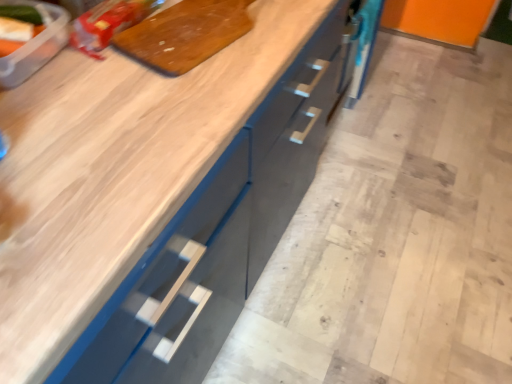
Question: From the image's perspective, is translucent plastic container at upper left, placed as the second food when sorted from right to left, on matte plastic bag at upper left, the second food from the left?

Choices:
 (A) no
 (B) yes

Answer: (A)

Question: Is translucent plastic container at upper left, placed as the second food when sorted from right to left, further to the viewer compared to matte plastic bag at upper left, which is the second food from front to back?

Choices:
 (A) no
 (B) yes

Answer: (A)

Question: Considering the relative positions of translucent plastic container at upper left, which is the 2th food from back to front, and matte plastic bag at upper left, which is the second food from front to back, in the image provided, is translucent plastic container at upper left, which is the 2th food from back to front, to the left of matte plastic bag at upper left, which is the second food from front to back, from the viewer's perspective?

Choices:
 (A) no
 (B) yes

Answer: (B)

Question: Can you confirm if translucent plastic container at upper left, arranged as the 1th food when viewed from the left, is smaller than matte plastic bag at upper left, the 1th food viewed from the right?

Choices:
 (A) yes
 (B) no

Answer: (A)

Question: From a real-world perspective, is translucent plastic container at upper left, which is counted as the first food, starting from the front, physically below matte plastic bag at upper left, the first food viewed from the back?

Choices:
 (A) yes
 (B) no

Answer: (B)

Question: Is translucent plastic container at upper left, which is the 2th food from back to front, located outside matte plastic bag at upper left, the first food viewed from the back?

Choices:
 (A) no
 (B) yes

Answer: (B)

Question: Is wooden cutting board at upper center thinner than translucent plastic container at upper left, which is counted as the first food, starting from the front?

Choices:
 (A) no
 (B) yes

Answer: (A)

Question: Is wooden cutting board at upper center completely or partially outside of translucent plastic container at upper left, arranged as the 1th food when viewed from the left?

Choices:
 (A) no
 (B) yes

Answer: (B)

Question: Can you confirm if wooden cutting board at upper center is taller than translucent plastic container at upper left, which is the 2th food from back to front?

Choices:
 (A) yes
 (B) no

Answer: (B)

Question: Does wooden cutting board at upper center have a smaller size compared to translucent plastic container at upper left, which is the 2th food from back to front?

Choices:
 (A) no
 (B) yes

Answer: (A)

Question: Is wooden cutting board at upper center to the left of translucent plastic container at upper left, which is the 2th food from back to front, from the viewer's perspective?

Choices:
 (A) yes
 (B) no

Answer: (B)

Question: Is wooden cutting board at upper center facing away from translucent plastic container at upper left, placed as the second food when sorted from right to left?

Choices:
 (A) no
 (B) yes

Answer: (A)

Question: From a real-world perspective, is matte plastic bag at upper left, which is the second food from front to back, over wooden cutting board at upper center?

Choices:
 (A) yes
 (B) no

Answer: (A)